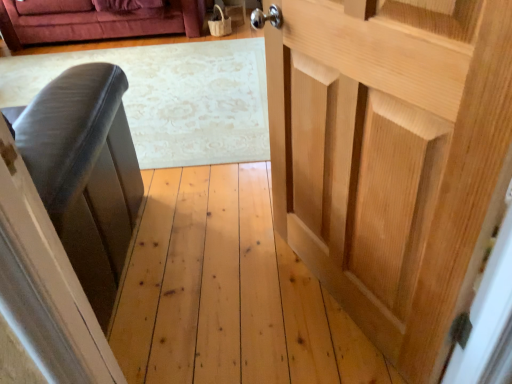
Question: Considering the relative sizes of natural wood door at right and velvet grey armchair at left in the image provided, is natural wood door at right shorter than velvet grey armchair at left?

Choices:
 (A) no
 (B) yes

Answer: (B)

Question: Does natural wood door at right have a smaller size compared to velvet grey armchair at left?

Choices:
 (A) no
 (B) yes

Answer: (B)

Question: From the image's perspective, does natural wood door at right appear lower than velvet grey armchair at left?

Choices:
 (A) yes
 (B) no

Answer: (A)

Question: Considering the relative sizes of natural wood door at right and velvet grey armchair at left in the image provided, is natural wood door at right thinner than velvet grey armchair at left?

Choices:
 (A) no
 (B) yes

Answer: (B)

Question: Could you tell me if natural wood door at right is turned towards velvet grey armchair at left?

Choices:
 (A) yes
 (B) no

Answer: (B)

Question: Is natural wood door at right far from velvet grey armchair at left?

Choices:
 (A) no
 (B) yes

Answer: (A)

Question: From the image's perspective, would you say velvet grey armchair at left is positioned over natural wood door at right?

Choices:
 (A) yes
 (B) no

Answer: (A)

Question: From the image's perspective, is velvet grey armchair at left under natural wood door at right?

Choices:
 (A) yes
 (B) no

Answer: (B)

Question: Considering the relative sizes of velvet grey armchair at left and natural wood door at right in the image provided, is velvet grey armchair at left taller than natural wood door at right?

Choices:
 (A) yes
 (B) no

Answer: (A)

Question: Does velvet grey armchair at left have a lesser width compared to natural wood door at right?

Choices:
 (A) yes
 (B) no

Answer: (B)

Question: Can you confirm if velvet grey armchair at left is positioned to the left of natural wood door at right?

Choices:
 (A) no
 (B) yes

Answer: (B)

Question: Is velvet grey armchair at left not within natural wood door at right?

Choices:
 (A) yes
 (B) no

Answer: (A)

Question: Would you say velvet grey armchair at left is to the left or to the right of natural wood door at right in the picture?

Choices:
 (A) right
 (B) left

Answer: (B)